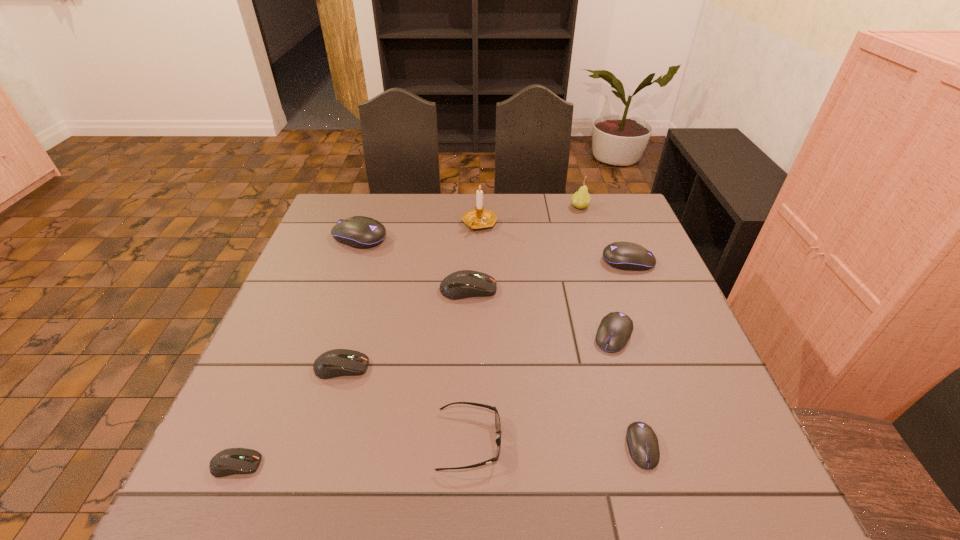
At what (x,y) coordinates should I click in order to perform the action: click on free space at the far right corner of the desktop. Please return your answer as a coordinate pair (x, y). Looking at the image, I should click on (588, 223).

What are the coordinates of `blank region between the ninth shortest object and the smallest dark computer equipment` in the screenshot? It's located at (408, 335).

Where is `vacant space that's between the sunglasses and the nearest black computer mouse`? vacant space that's between the sunglasses and the nearest black computer mouse is located at coordinates (556, 444).

At what (x,y) coordinates should I click in order to perform the action: click on free area in between the biggest black computer mouse and the farthest dark computer equipment. Please return your answer as a coordinate pair (x, y). The image size is (960, 540). Looking at the image, I should click on (414, 264).

Image resolution: width=960 pixels, height=540 pixels. I want to click on vacant region between the fourth farthest computer mouse and the nearest dark computer equipment, so click(x=424, y=400).

Find the location of a particular element. vacant region between the smallest black computer mouse and the sunglasses is located at coordinates (556, 444).

The image size is (960, 540). Identify the location of free space between the second farthest computer mouse and the farthest dark computer equipment. (548, 275).

Where is `free spot between the green pear and the smallest dark computer equipment`? free spot between the green pear and the smallest dark computer equipment is located at coordinates (408, 335).

Where is `vacant space that is in between the farthest computer mouse and the fourth computer mouse from right to left`? vacant space that is in between the farthest computer mouse and the fourth computer mouse from right to left is located at coordinates (414, 264).

Identify the location of free spot between the farthest computer mouse and the smallest black computer mouse. click(x=500, y=342).